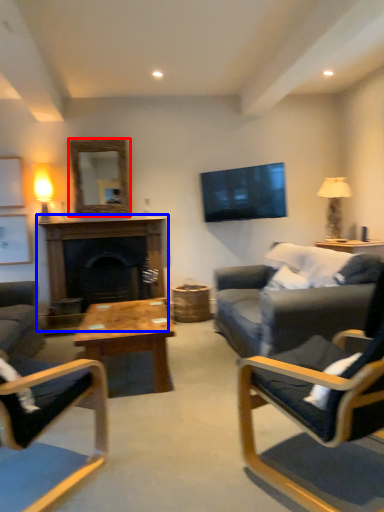
Question: Which point is further to the camera, mirror (highlighted by a red box) or fireplace (highlighted by a blue box)?

Choices:
 (A) mirror
 (B) fireplace

Answer: (A)